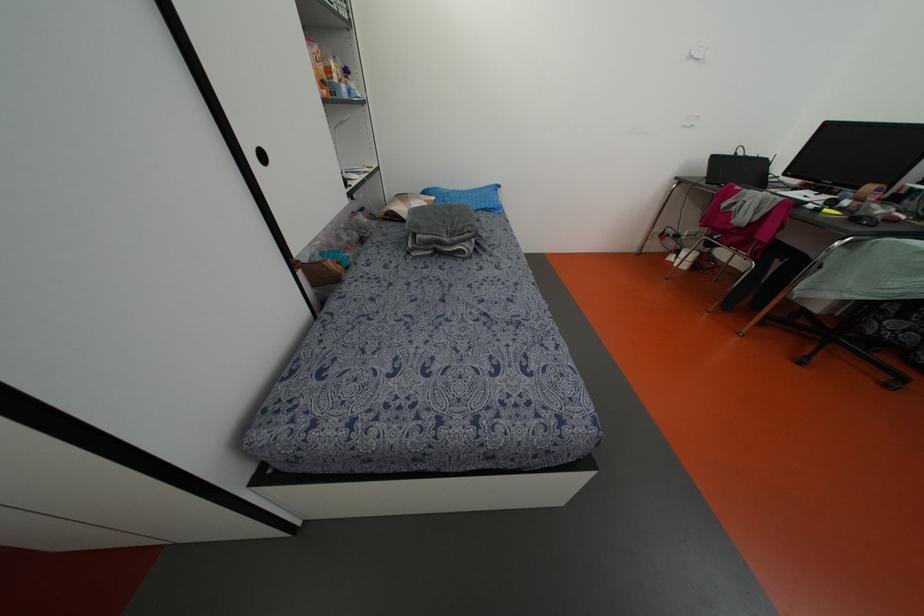
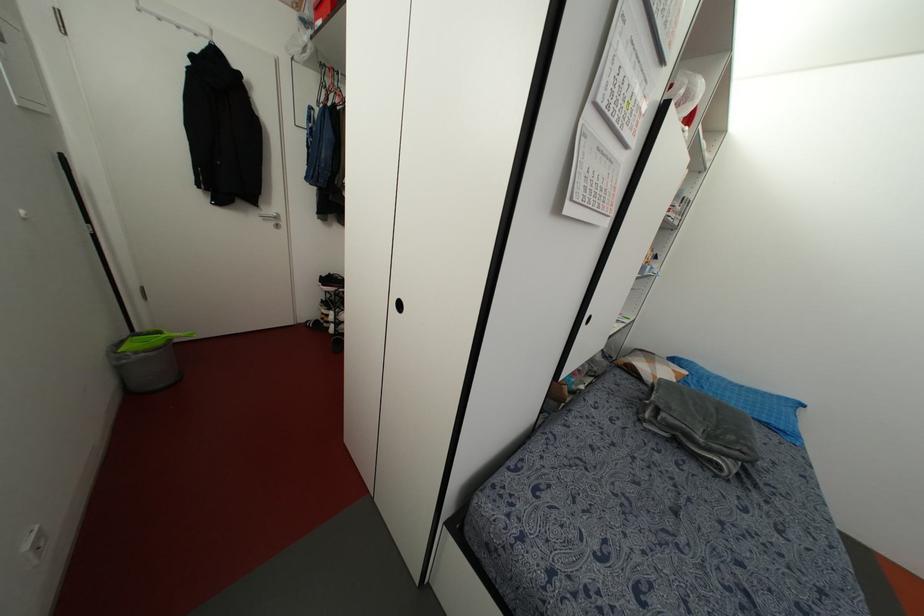
Question: I am providing you with two images of the same scene from different viewpoints. Please identify which objects are invisible in image2.

Choices:
 (A) red clothes hanger
 (B) black cabinet handle
 (C) silver door handle
 (D) none of these

Answer: (D)